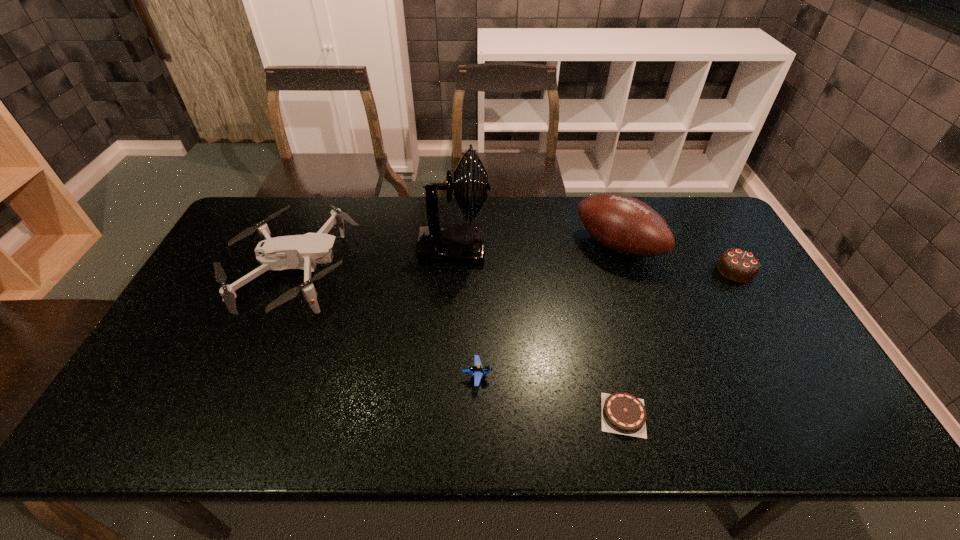
Locate an element on the screen. The image size is (960, 540). vacant area between the fifth tallest object and the farther chocolate cake is located at coordinates (607, 323).

Locate an element on the screen. This screenshot has height=540, width=960. empty space that is in between the fifth farthest object and the fifth shortest object is located at coordinates (547, 311).

Image resolution: width=960 pixels, height=540 pixels. I want to click on free space that is in between the rightmost object and the shortest object, so click(680, 342).

Where is `free space between the fifth tallest object and the nearest object`? The width and height of the screenshot is (960, 540). free space between the fifth tallest object and the nearest object is located at coordinates (550, 395).

Locate an element on the screen. The width and height of the screenshot is (960, 540). unoccupied area between the tallest object and the rightmost object is located at coordinates (595, 259).

You are a GUI agent. You are given a task and a screenshot of the screen. Output one action in this format:
    pyautogui.click(x=<x>, y=<y>)
    Task: Click on the unoccupied area between the drone and the nearest object
    This screenshot has height=540, width=960.
    Given the screenshot: What is the action you would take?
    pyautogui.click(x=459, y=344)

The image size is (960, 540). Find the location of `free area in between the taller chocolate cake and the second tallest object`. free area in between the taller chocolate cake and the second tallest object is located at coordinates (677, 258).

You are a GUI agent. You are given a task and a screenshot of the screen. Output one action in this format:
    pyautogui.click(x=<x>, y=<y>)
    Task: Click on the object that stands as the fourth closest to the nearer chocolate cake
    Image resolution: width=960 pixels, height=540 pixels.
    Given the screenshot: What is the action you would take?
    pyautogui.click(x=739, y=265)

The image size is (960, 540). In order to click on object that stands as the fifth closest to the Lego in this screenshot , I will do `click(739, 265)`.

At what (x,y) coordinates should I click in order to perform the action: click on free space that satisfies the following two spatial constraints: 1. on the back side of the shortest object; 2. on the front-facing side of the Lego. Please return your answer as a coordinate pair (x, y). This screenshot has height=540, width=960. Looking at the image, I should click on (613, 376).